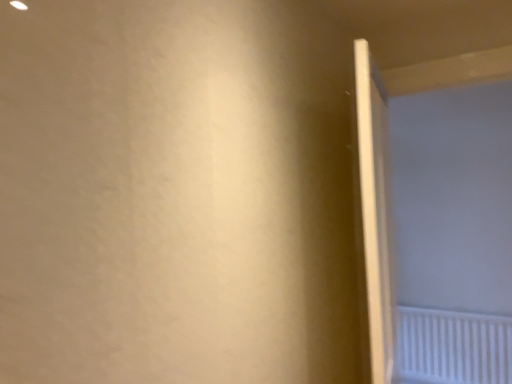
Question: Is white plastic radiator at lower right looking in the opposite direction of white matte screen door at right?

Choices:
 (A) no
 (B) yes

Answer: (A)

Question: Is white plastic radiator at lower right facing towards white matte screen door at right?

Choices:
 (A) yes
 (B) no

Answer: (B)

Question: Is white plastic radiator at lower right positioned behind white matte screen door at right?

Choices:
 (A) yes
 (B) no

Answer: (A)

Question: Does white plastic radiator at lower right have a smaller size compared to white matte screen door at right?

Choices:
 (A) yes
 (B) no

Answer: (A)

Question: Can you confirm if white plastic radiator at lower right is thinner than white matte screen door at right?

Choices:
 (A) yes
 (B) no

Answer: (A)

Question: Considering the relative sizes of white plastic radiator at lower right and white matte screen door at right in the image provided, is white plastic radiator at lower right taller than white matte screen door at right?

Choices:
 (A) yes
 (B) no

Answer: (B)

Question: Does white glossy door at right appear on the right side of white plastic radiator at lower right?

Choices:
 (A) yes
 (B) no

Answer: (B)

Question: From a real-world perspective, is white glossy door at right beneath white plastic radiator at lower right?

Choices:
 (A) yes
 (B) no

Answer: (B)

Question: Would you say white glossy door at right is outside white plastic radiator at lower right?

Choices:
 (A) yes
 (B) no

Answer: (A)

Question: Can you confirm if white glossy door at right is thinner than white plastic radiator at lower right?

Choices:
 (A) yes
 (B) no

Answer: (B)

Question: Does white glossy door at right turn towards white plastic radiator at lower right?

Choices:
 (A) no
 (B) yes

Answer: (A)

Question: Would you say white plastic radiator at lower right is part of white glossy door at right's contents?

Choices:
 (A) yes
 (B) no

Answer: (B)

Question: Can you confirm if white matte screen door at right is thinner than white plastic radiator at lower right?

Choices:
 (A) no
 (B) yes

Answer: (A)